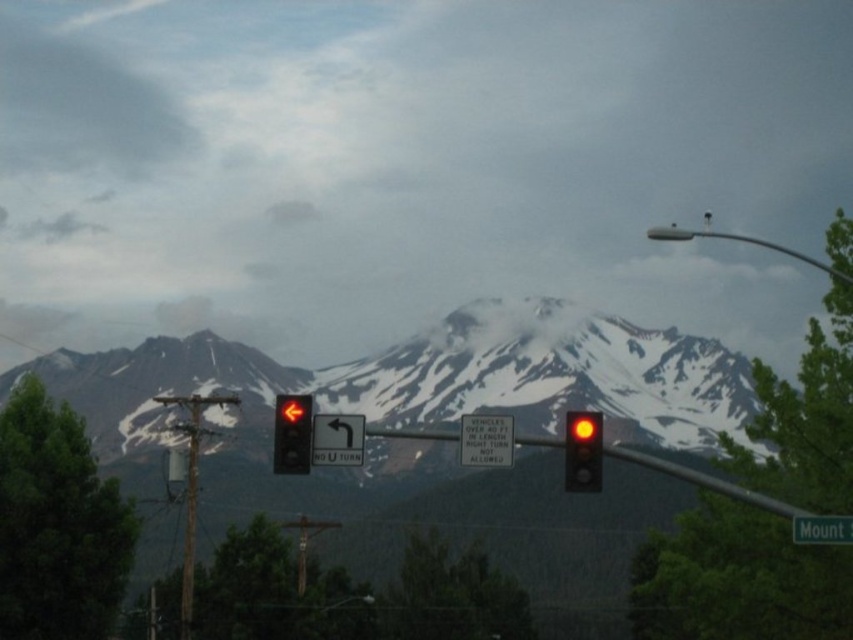
Question: Is metallic pole at upper right wider than green plastic sign at center?

Choices:
 (A) no
 (B) yes

Answer: (B)

Question: Estimate the real-world distances between objects in this image. Which object is closer to the matte black arrow at left?

Choices:
 (A) matte glass traffic light at center
 (B) metallic pole at upper right
 (C) green plastic sign at center

Answer: (A)

Question: Can you confirm if matte black arrow at left is positioned below black plastic traffic sign at center?

Choices:
 (A) yes
 (B) no

Answer: (A)

Question: Which object is positioned farthest from the matte black arrow at left?

Choices:
 (A) metallic pole at upper right
 (B) green plastic sign at center
 (C) white plastic sign at center
 (D) black plastic traffic sign at center

Answer: (A)

Question: Which of the following is the farthest from the observer?

Choices:
 (A) (483, 460)
 (B) (595, 449)
 (C) (698, 232)

Answer: (C)

Question: Is matte black arrow at left above green plastic sign at center?

Choices:
 (A) no
 (B) yes

Answer: (B)